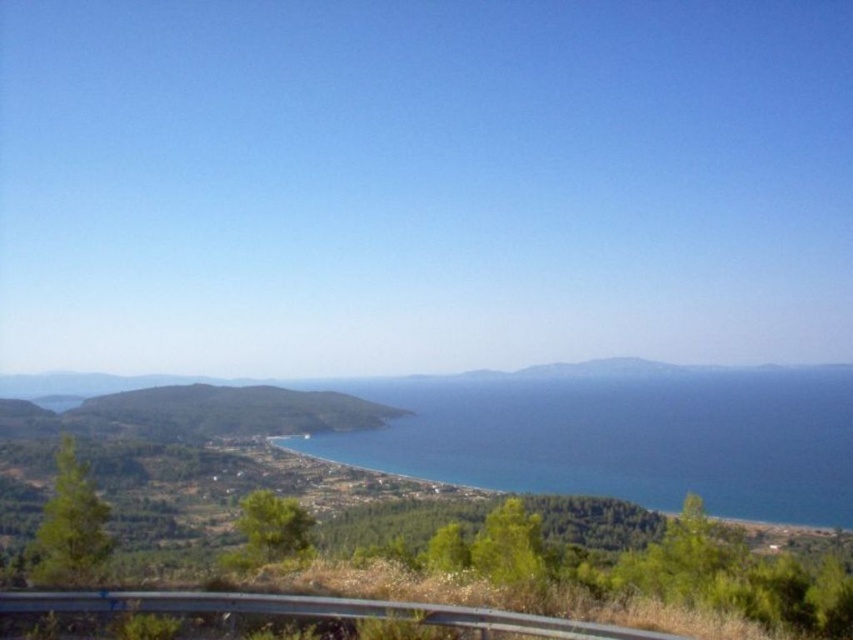
You are a photographer standing at the viewpoint. You want to capture a photo where the blue water at center and the metallic gray guardrail at lower center are both visible. Which object should you focus on first to ensure both are in the frame?

You should focus on the metallic gray guardrail at lower center first because it is closer to you than the blue water at center, ensuring both are in the frame.

You are standing at the roadside viewpoint looking out at the coastal landscape. You see the blue water at center and the metallic gray guardrail at lower center. Which object is closer to you?

The metallic gray guardrail at lower center is closer to you because the blue water at center is further away.

You are standing at the guardrail in the coastal landscape and see a point marked at coordinates (622, 435). Based on the image description, what is the location of this point relative to the blue water at center?

The point at (622, 435) is located on the blue water at center.